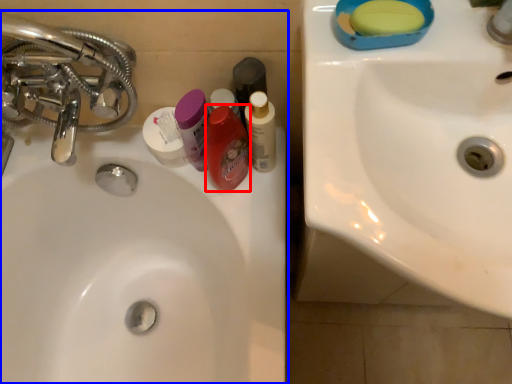
Question: Which object appears closest to the camera in this image, mouthwash (highlighted by a red box) or sink (highlighted by a blue box)?

Choices:
 (A) mouthwash
 (B) sink

Answer: (A)